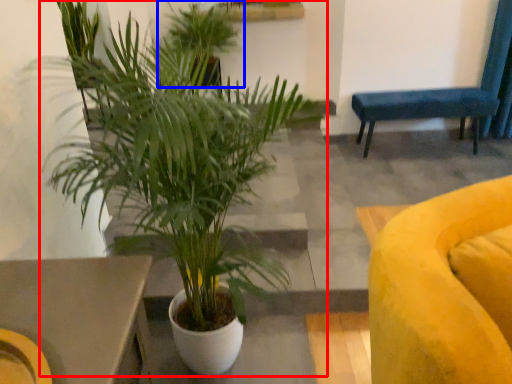
Question: Which object appears closest to the camera in this image, houseplant (highlighted by a red box) or houseplant (highlighted by a blue box)?

Choices:
 (A) houseplant
 (B) houseplant

Answer: (A)